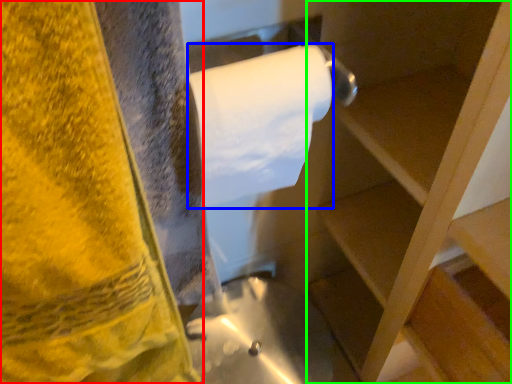
Question: Which is farther away from towel (highlighted by a red box)? toilet paper (highlighted by a blue box) or shelf (highlighted by a green box)?

Choices:
 (A) toilet paper
 (B) shelf

Answer: (B)